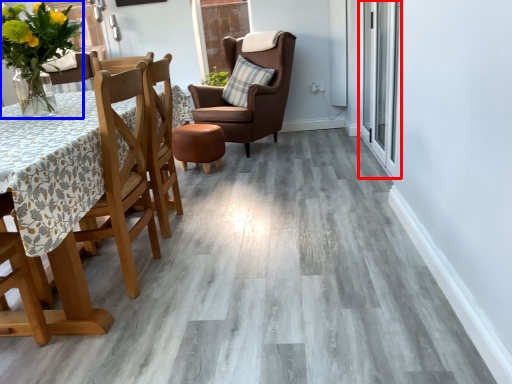
Question: Among these objects, which one is farthest to the camera, glass door (highlighted by a red box) or floral arrangement (highlighted by a blue box)?

Choices:
 (A) glass door
 (B) floral arrangement

Answer: (A)